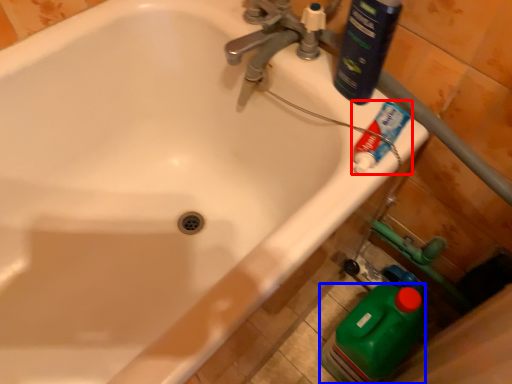
Question: Which of the following is the closest to the observer, toothpaste (highlighted by a red box) or cleaning product (highlighted by a blue box)?

Choices:
 (A) toothpaste
 (B) cleaning product

Answer: (A)